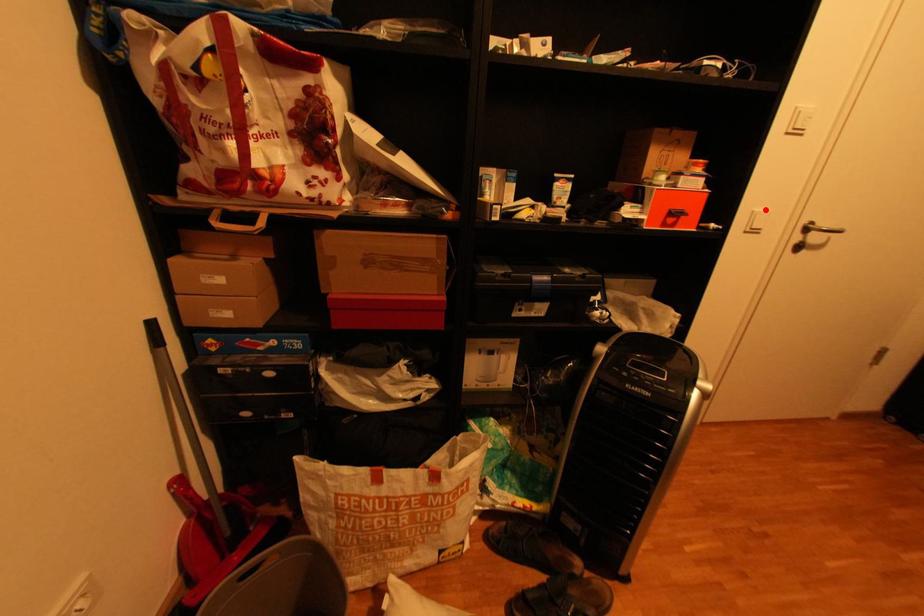
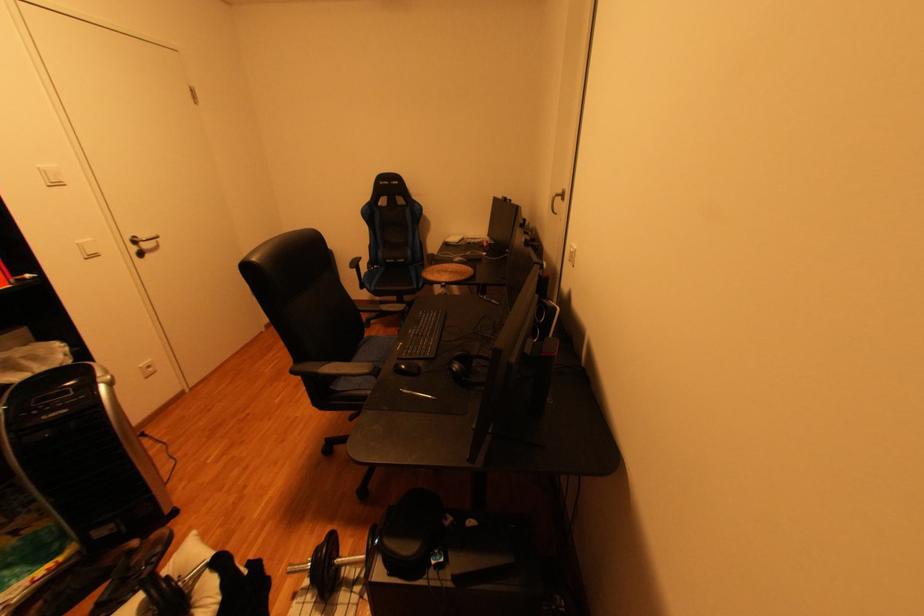
Question: I am providing you with two images of the same scene from different viewpoints. Image1 has a red point marked. In image2, the corresponding 3D location appears at what relative position? Reply with the corresponding letter.

Choices:
 (A) Closer
 (B) Farther

Answer: (B)